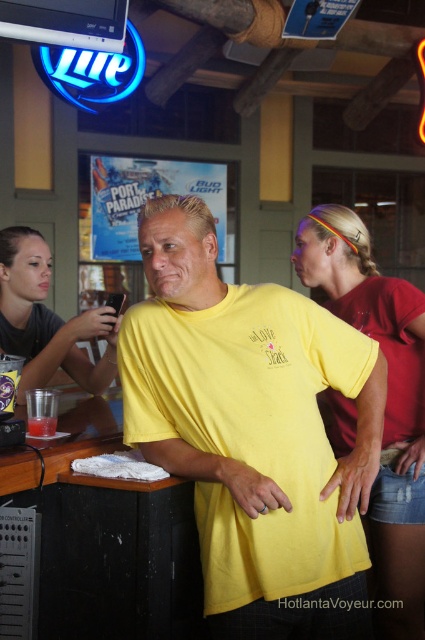
You are a bartender preparing to place a new drink order on the counter. You have a wide glass that needs space. Looking at the matte gray shirt at center and the clear plastic cup at bar left, which object should you move to make space for the glass?

You should move the clear plastic cup at bar left because the matte gray shirt at center is wider than the clear plastic cup at bar left, so moving the cup would free up enough space for the wide glass.